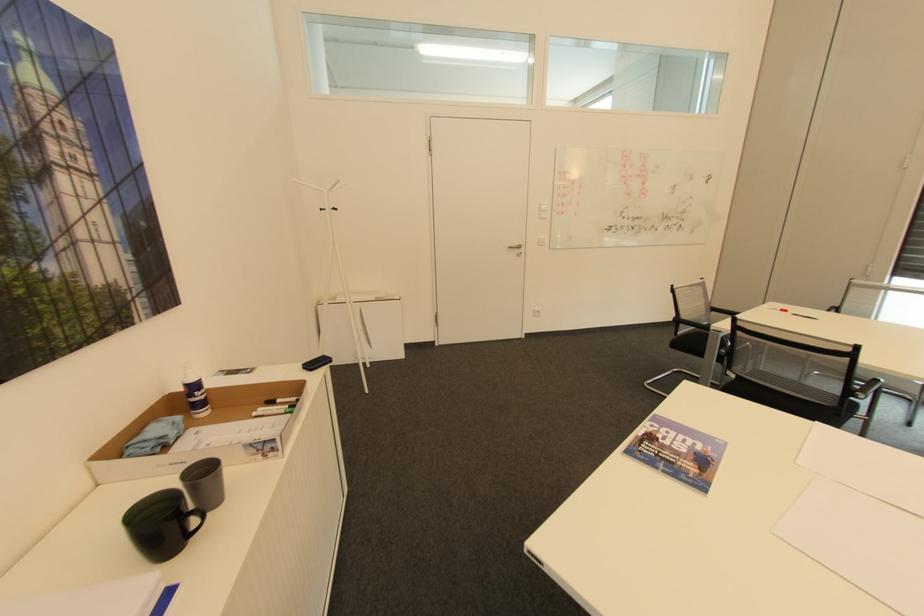
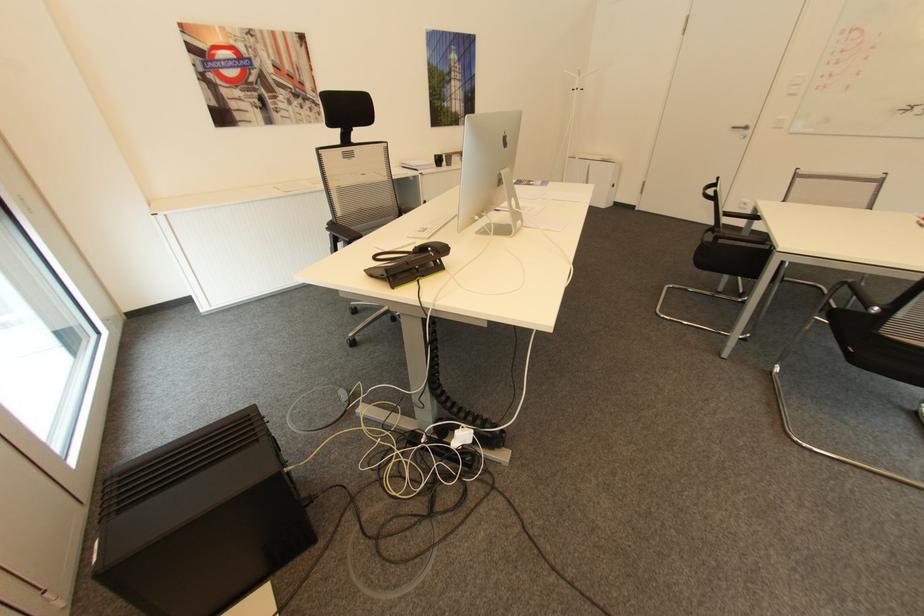
Locate, in the second image, the point that corresponds to (x=524, y=246) in the first image.

(749, 128)